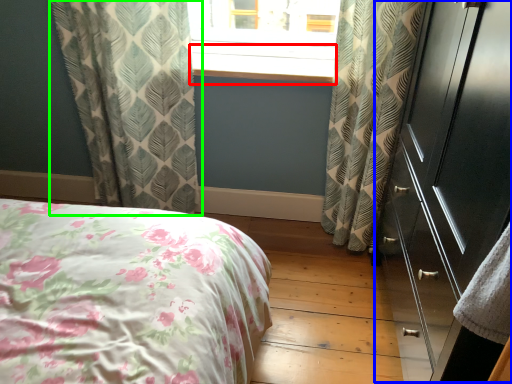
Question: Estimate the real-world distances between objects in this image. Which object is farther from window sill (highlighted by a red box), dresser (highlighted by a blue box) or curtain (highlighted by a green box)?

Choices:
 (A) dresser
 (B) curtain

Answer: (A)